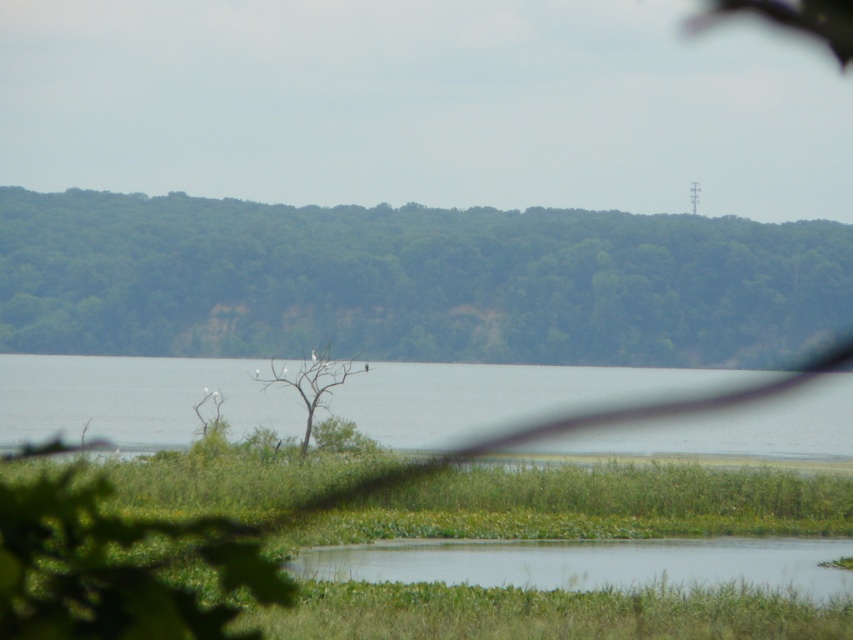
Question: Which of the following is the farthest from the observer?

Choices:
 (A) (302, 561)
 (B) (106, 387)
 (C) (415, 340)
 (D) (305, 440)

Answer: (C)

Question: Which is farther from the green leafy tree at upper center?

Choices:
 (A) dead wood tree at center
 (B) clear water at center
 (C) clear water at lower center

Answer: (C)

Question: Is clear water at center wider than dead wood tree at center?

Choices:
 (A) yes
 (B) no

Answer: (A)

Question: Which point is closer to the camera taking this photo?

Choices:
 (A) (338, 369)
 (B) (735, 547)
 (C) (55, 380)

Answer: (B)

Question: Does clear water at center come behind clear water at lower center?

Choices:
 (A) no
 (B) yes

Answer: (B)

Question: Where is green leafy tree at upper center located in relation to clear water at center in the image?

Choices:
 (A) left
 (B) right

Answer: (B)